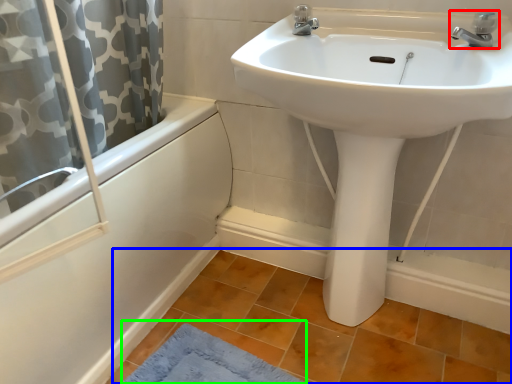
Question: Which object is positioned farthest from tap (highlighted by a red box)? Select from tile (highlighted by a blue box) and bath mat (highlighted by a green box).

Choices:
 (A) tile
 (B) bath mat

Answer: (B)